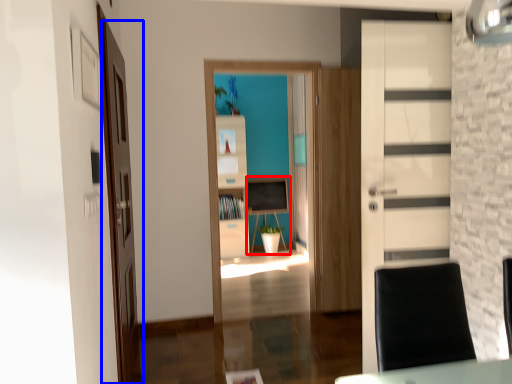
Question: Which object appears farthest to the camera in this image, computer desk (highlighted by a red box) or door (highlighted by a blue box)?

Choices:
 (A) computer desk
 (B) door

Answer: (A)